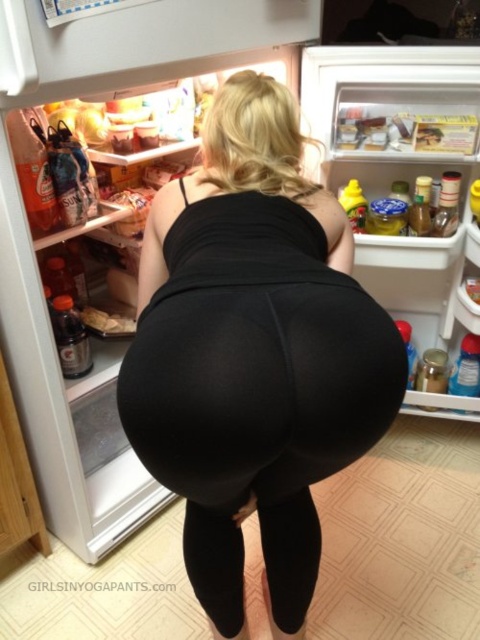
Question: Which of the following is the closest to the observer?

Choices:
 (A) (267, 531)
 (B) (254, 344)

Answer: (B)

Question: Among these points, which one is nearest to the camera?

Choices:
 (A) (357, 307)
 (B) (289, 541)

Answer: (A)

Question: Where is black matte leggings at center located in relation to black leggings at lower center in the image?

Choices:
 (A) left
 (B) right

Answer: (A)

Question: Is black matte leggings at center thinner than black leggings at lower center?

Choices:
 (A) no
 (B) yes

Answer: (A)

Question: Observing the image, what is the correct spatial positioning of black matte leggings at center in reference to black leggings at lower center?

Choices:
 (A) right
 (B) left

Answer: (B)